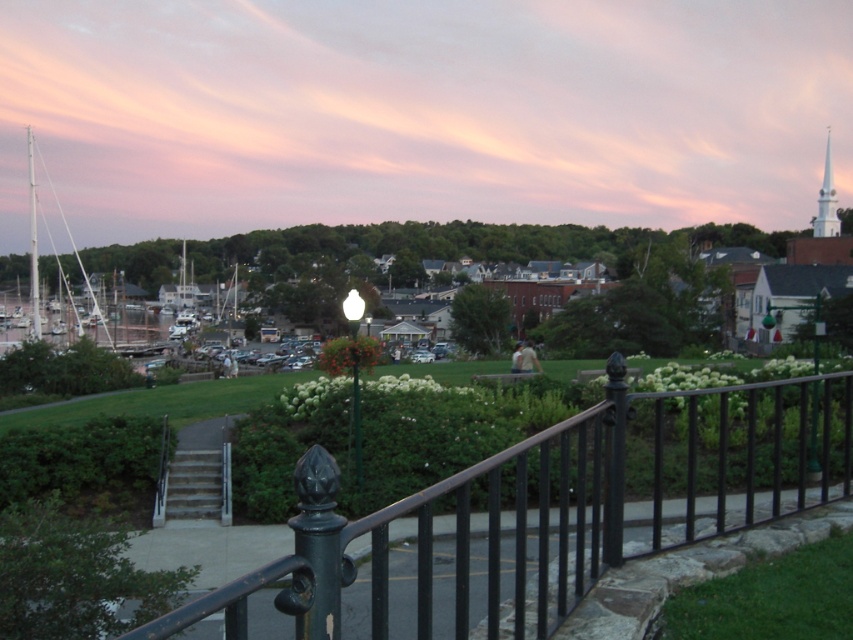
You are holding a camera and want to take a photo of the black metal fence at center. If you are standing 6 feet away from the fence, will you be able to capture the entire fence in your shot without moving closer?

The black metal fence at center and camera are 5.94 feet apart. Since you are standing 6 feet away, which is slightly farther than the required distance, you might need to move a tiny bit closer to ensure the entire fence fits in the frame.

You are standing at the black metal railing looking out. There is a pink sky at upper center and a white matte sailboat at left. How far apart are these two objects from your viewpoint?

The distance between the pink sky at upper center and the white matte sailboat at left is 116.68 meters.

You are standing on the stone wall with the black metal railing and looking out at the pink sky at upper center and the white matte sailboat at left. Which object is higher in the scene?

The pink sky at upper center is higher than the white matte sailboat at left because it is positioned above it.